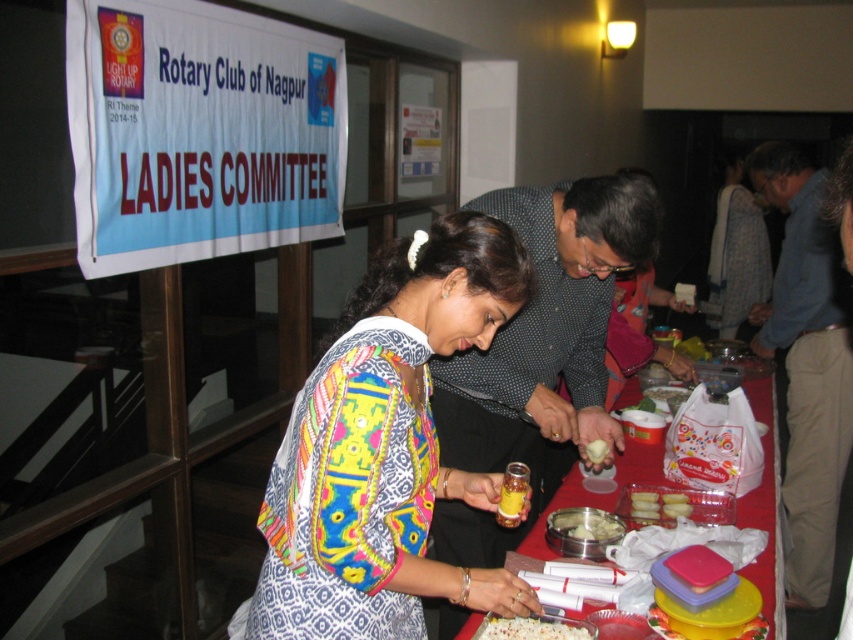
Does point (706, 275) come in front of point (651, 500)?

No, (706, 275) is further to viewer.

Does patterned fabric dress at center have a smaller size compared to yellow matte cookies at center?

No.

Where is `patterned fabric dress at center`? patterned fabric dress at center is located at coordinates (735, 253).

This screenshot has height=640, width=853. What are the coordinates of `patterned fabric dress at center` in the screenshot? It's located at (735, 253).

Who is higher up, polka dot shirt at center or patterned fabric dress at center?

patterned fabric dress at center is above.

Who is lower down, polka dot shirt at center or patterned fabric dress at center?

polka dot shirt at center is below.

Does point (567, 248) come farther from viewer compared to point (740, 193)?

That is False.

The height and width of the screenshot is (640, 853). What are the coordinates of `polka dot shirt at center` in the screenshot? It's located at (541, 353).

Which is below, translucent plastic table at center or shiny metallic tray at center?

shiny metallic tray at center is lower down.

How distant is translucent plastic table at center from shiny metallic tray at center?

A distance of 33.34 centimeters exists between translucent plastic table at center and shiny metallic tray at center.

Between point (764, 522) and point (601, 529), which one is positioned in front?

Point (601, 529) is in front.

This screenshot has height=640, width=853. What are the coordinates of `translucent plastic table at center` in the screenshot? It's located at tap(596, 493).